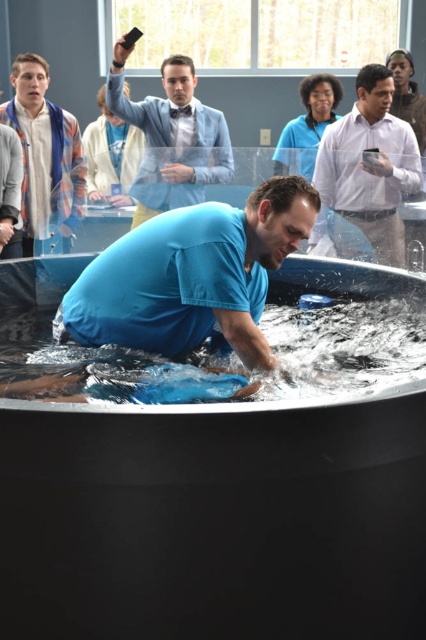
Question: Which point is closer to the camera taking this photo?

Choices:
 (A) (127, 573)
 (B) (120, 90)
 (C) (114, 170)

Answer: (A)

Question: Does clear plastic water at center appear over light blue shirt at upper left?

Choices:
 (A) yes
 (B) no

Answer: (B)

Question: Which point is closer to the camera?

Choices:
 (A) blue denim shirt at center
 (B) light blue shirt at upper center

Answer: (A)

Question: Can you confirm if blue plastic tub at center is positioned above white shirt at upper right?

Choices:
 (A) no
 (B) yes

Answer: (A)

Question: Can you confirm if white shirt at upper right is positioned to the right of light brown wood phone at upper right?

Choices:
 (A) no
 (B) yes

Answer: (A)

Question: Considering the real-world distances, which object is farthest from the light blue shirt at upper center?

Choices:
 (A) white shirt at upper right
 (B) blue plastic tub at center
 (C) clear plastic water at center

Answer: (B)